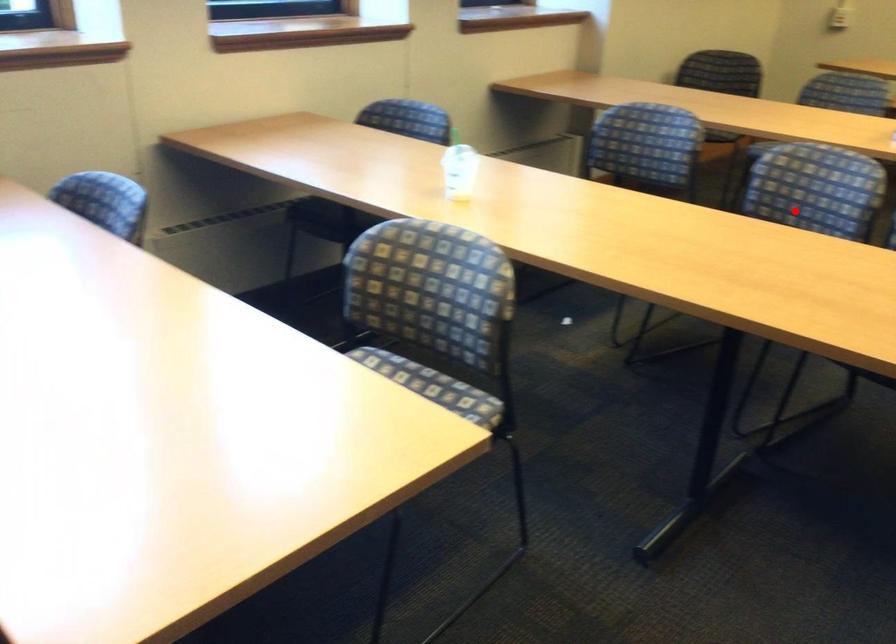
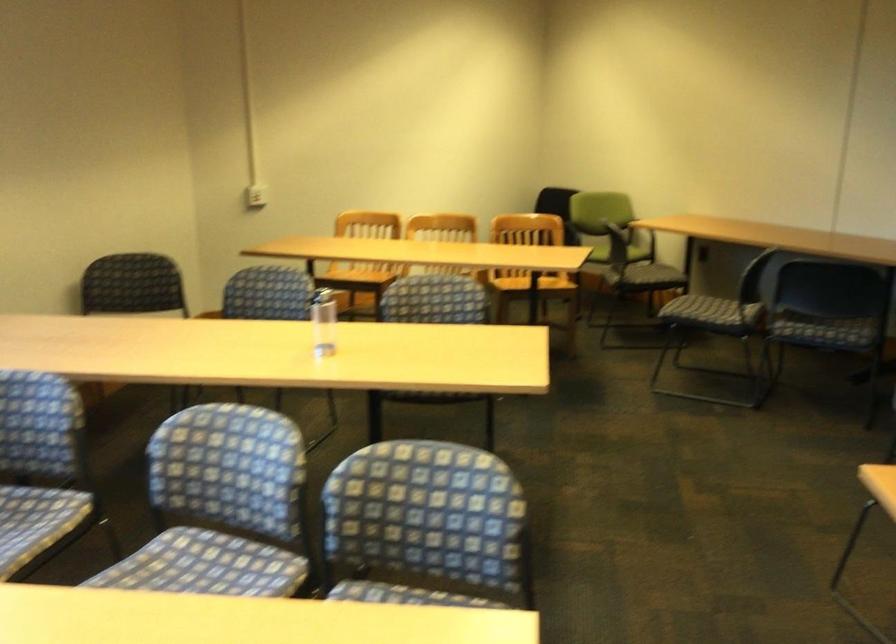
The point at the highlighted location is marked in the first image. Where is the corresponding point in the second image?

(221, 506)